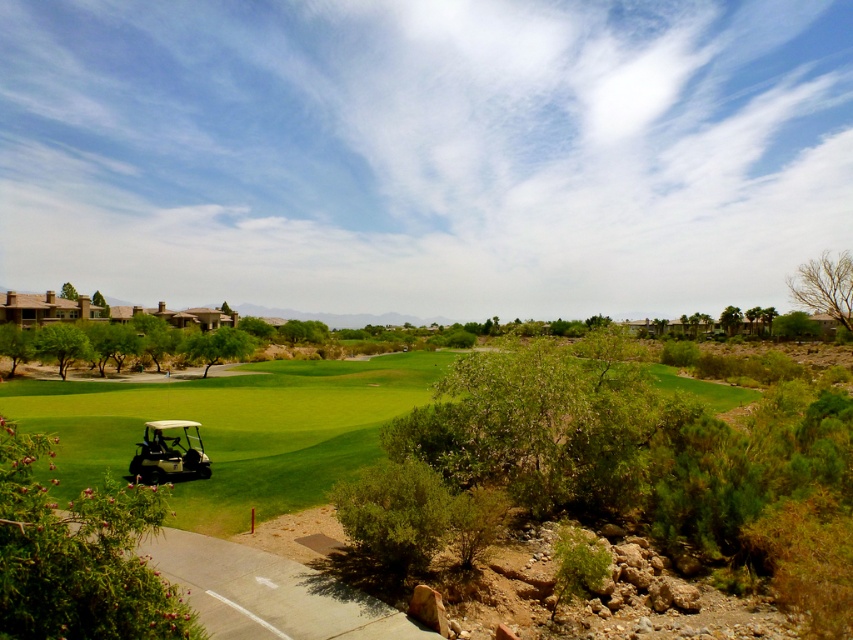
Question: Which of the following is the farthest from the observer?

Choices:
 (A) white matte golf cart at lower left
 (B) white plastic golf cart at lower left

Answer: (A)

Question: Does white plastic golf cart at lower left appear on the left side of white matte golf cart at lower left?

Choices:
 (A) yes
 (B) no

Answer: (B)

Question: Can you confirm if white plastic golf cart at lower left is bigger than white matte golf cart at lower left?

Choices:
 (A) no
 (B) yes

Answer: (B)

Question: Which object is closer to the camera taking this photo?

Choices:
 (A) white plastic golf cart at lower left
 (B) white matte golf cart at lower left

Answer: (A)

Question: Is white plastic golf cart at lower left positioned before white matte golf cart at lower left?

Choices:
 (A) yes
 (B) no

Answer: (A)